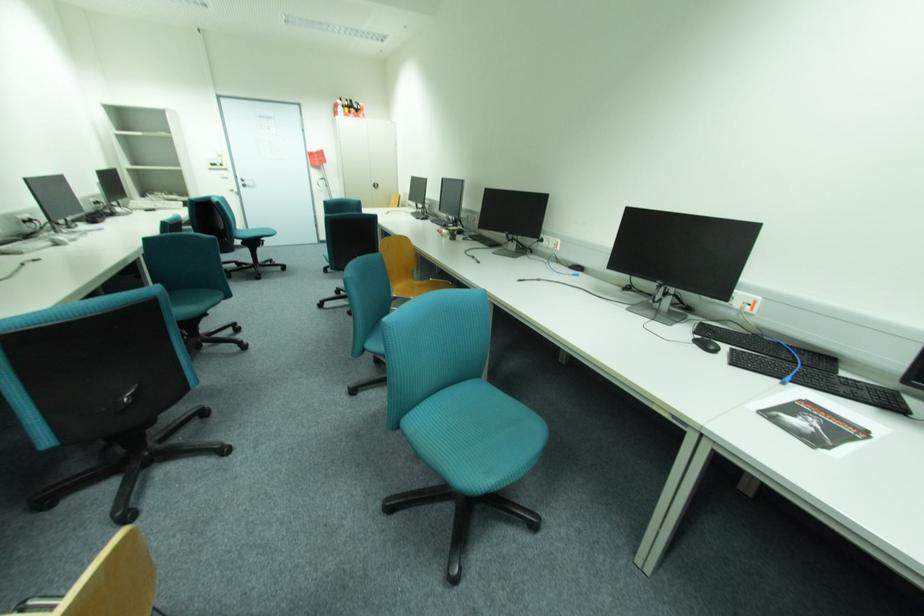
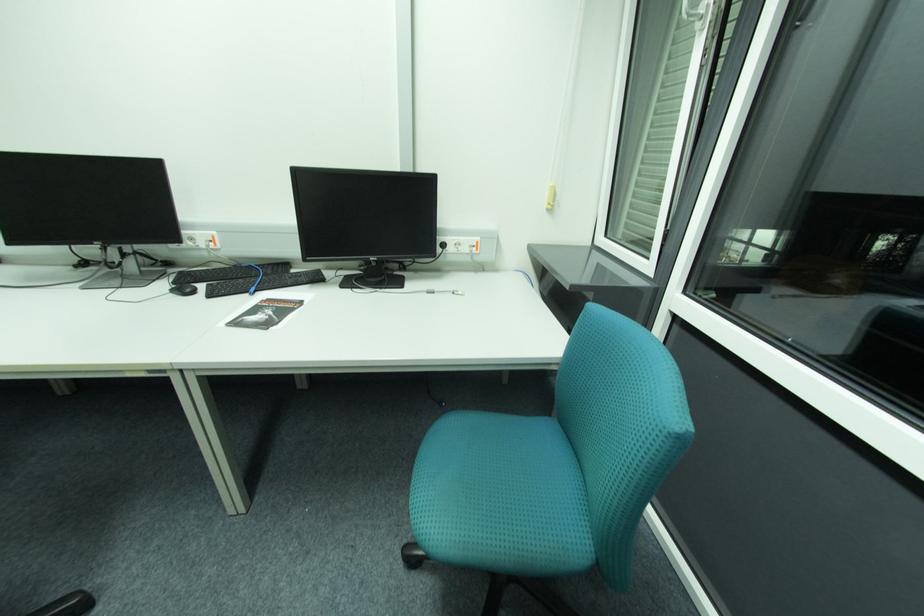
Find the pixel in the second image that matches point 849,374 in the first image.

(298, 272)